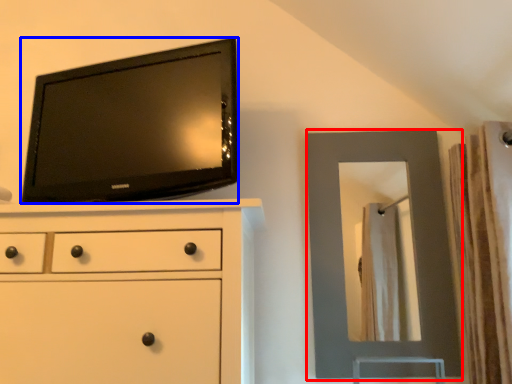
Question: Which object is closer to the camera taking this photo, mirror (highlighted by a red box) or television (highlighted by a blue box)?

Choices:
 (A) mirror
 (B) television

Answer: (B)